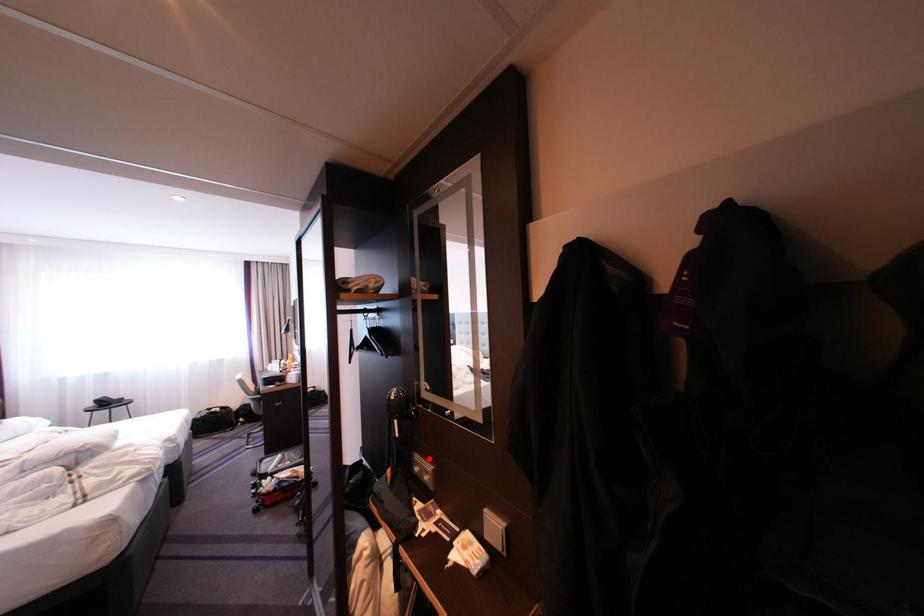
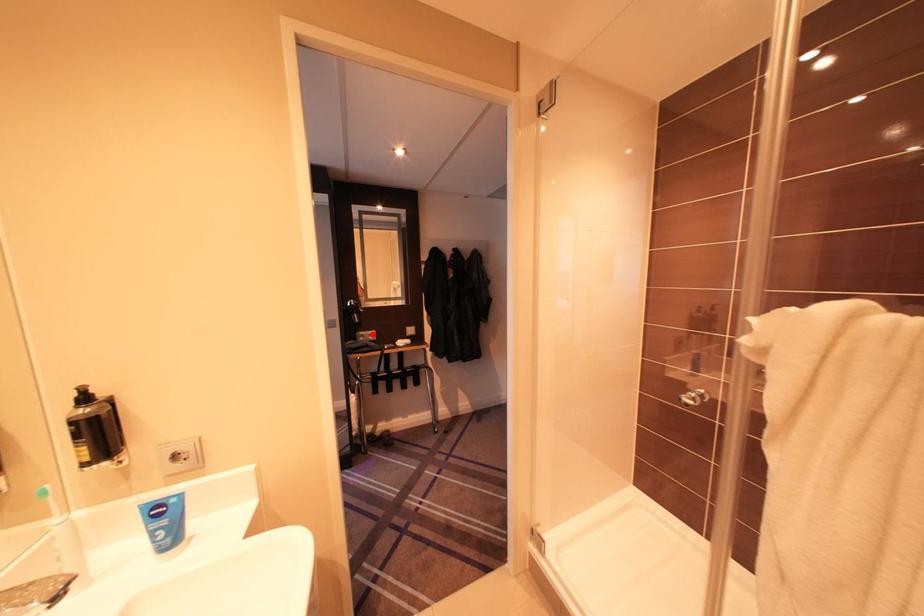
I am providing you with two images of the same scene from different viewpoints. A red point is marked on the first image and another point is marked on the second image. Are the points marked in image1 and image2 representing the same 3D position?

Yes